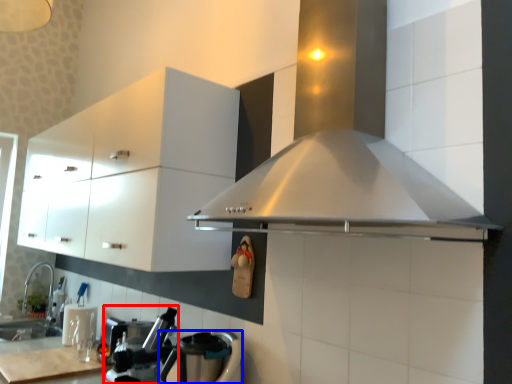
Question: Which object is closer to the camera taking this photo, coffee machine (highlighted by a red box) or kitchen appliance (highlighted by a blue box)?

Choices:
 (A) coffee machine
 (B) kitchen appliance

Answer: (B)